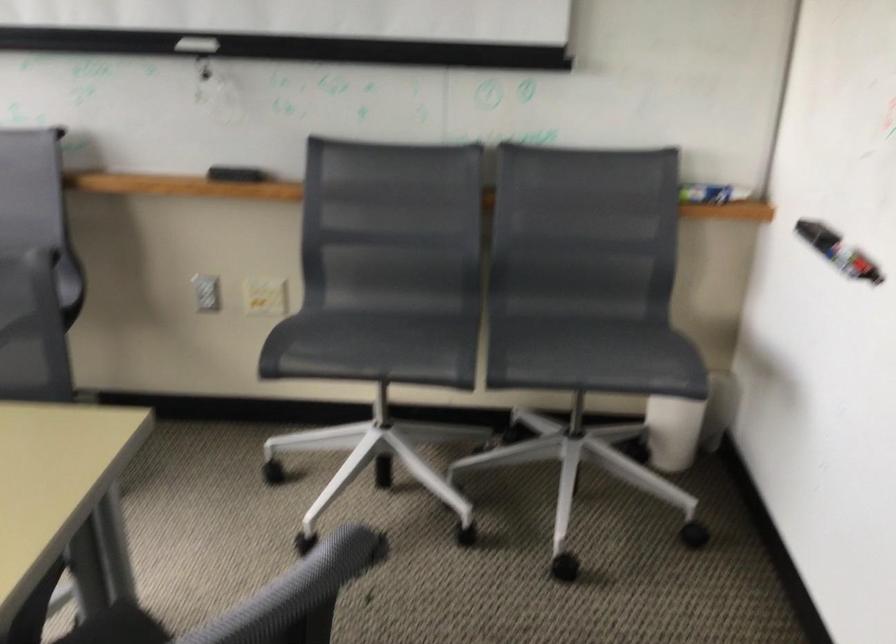
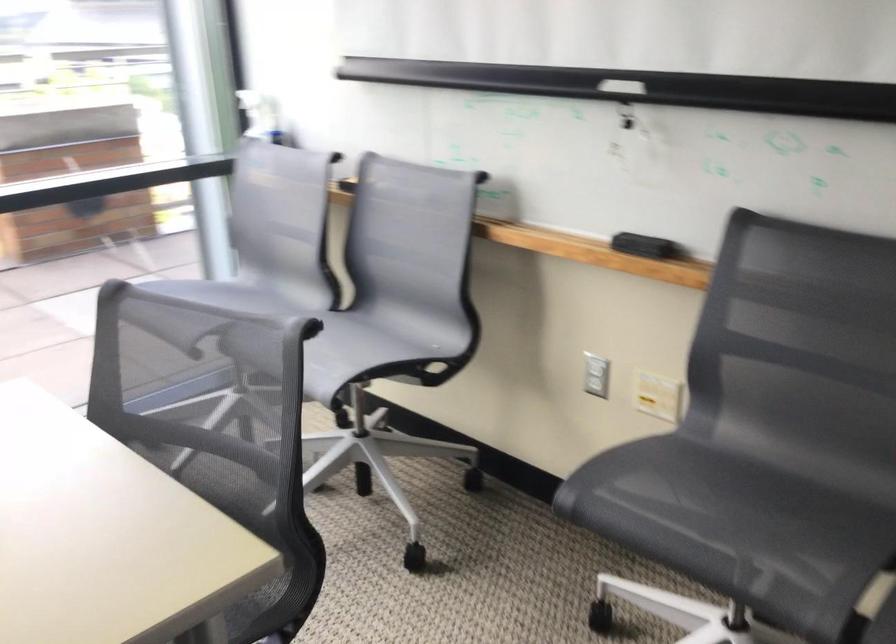
In the second image, find the point that corresponds to [399,330] in the first image.

(752, 506)